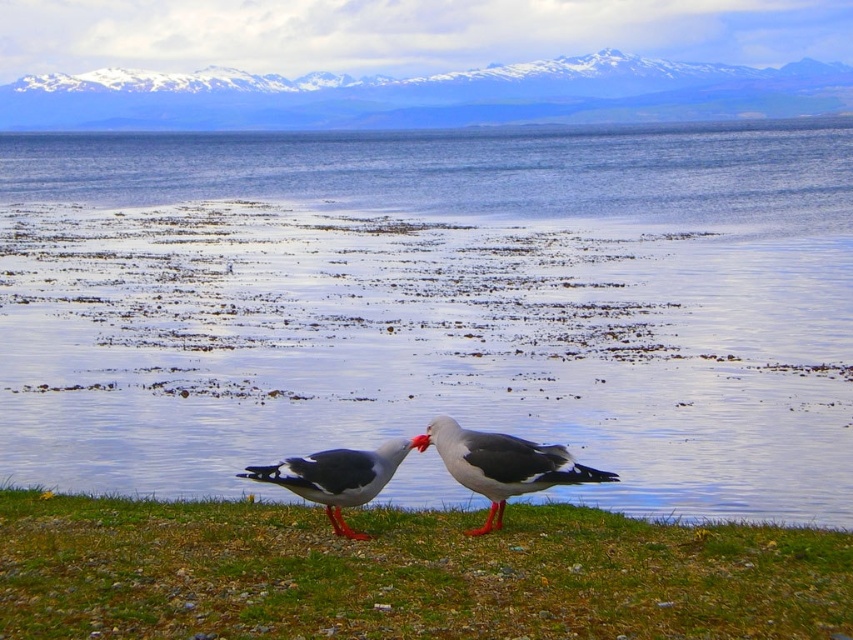
Between snowy mountain range at upper center and gray matte seagull at center, which one has more height?

snowy mountain range at upper center

Can you confirm if snowy mountain range at upper center is smaller than gray matte seagull at center?

Actually, snowy mountain range at upper center might be larger than gray matte seagull at center.

The height and width of the screenshot is (640, 853). What do you see at coordinates (426, 97) in the screenshot?
I see `snowy mountain range at upper center` at bounding box center [426, 97].

Locate an element on the screen. The width and height of the screenshot is (853, 640). snowy mountain range at upper center is located at coordinates (426, 97).

Which is more to the left, green grass at lower center or gray matte seagull at center?

green grass at lower center is more to the left.

Which is more to the right, green grass at lower center or gray matte seagull at center?

Positioned to the right is gray matte seagull at center.

Which is behind, point (158, 516) or point (576, 481)?

Point (158, 516)

Locate an element on the screen. This screenshot has height=640, width=853. green grass at lower center is located at coordinates (405, 573).

Does clear water at center appear on the left side of green grass at lower center?

Correct, you'll find clear water at center to the left of green grass at lower center.

Does point (76, 362) come farther from viewer compared to point (577, 509)?

Yes, point (76, 362) is behind point (577, 509).

Who is more forward, [422,301] or [440,586]?

Positioned in front is point [440,586].

Find the location of a particular element. The width and height of the screenshot is (853, 640). clear water at center is located at coordinates (433, 307).